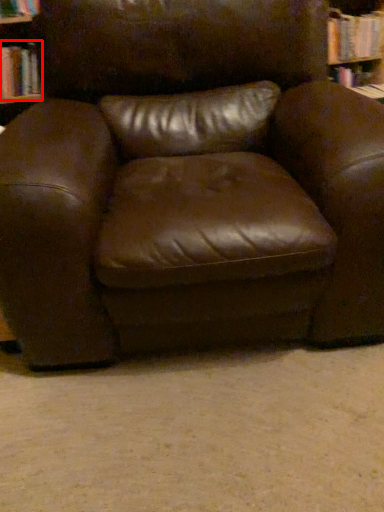
Question: From the image's perspective, considering the relative positions of book (annotated by the red box) and chair in the image provided, where is book (annotated by the red box) located with respect to the staircase?

Choices:
 (A) above
 (B) below

Answer: (A)